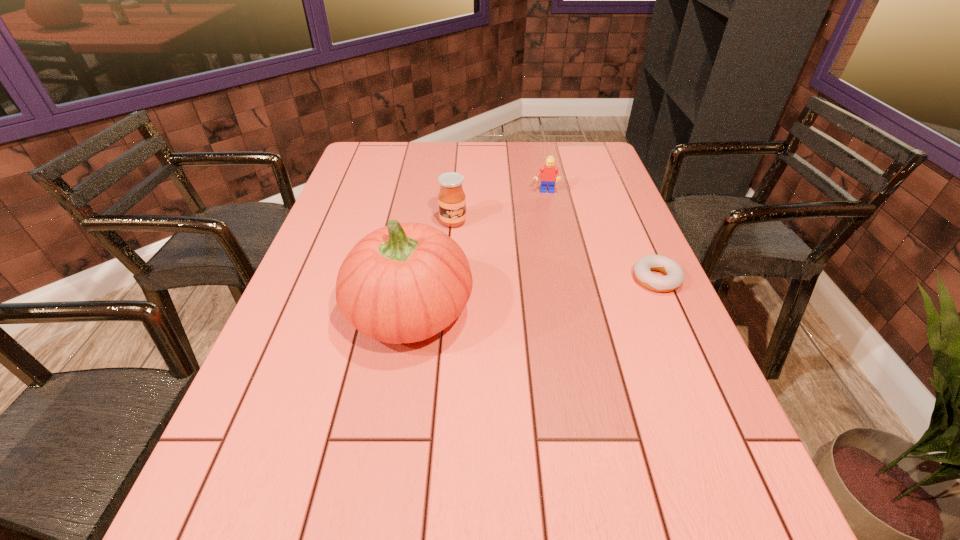
This screenshot has width=960, height=540. In order to click on free spot located 0.300m on the front-facing side of the farthest object in this screenshot , I will do `click(546, 255)`.

I want to click on vacant space positioned on the front-facing side of the farthest object, so click(x=546, y=235).

Identify the location of vacant area located on the front-facing side of the second farthest object. (496, 285).

Where is `blank area located 0.360m on the front-facing side of the second farthest object`? blank area located 0.360m on the front-facing side of the second farthest object is located at coordinates (516, 311).

Find the location of a particular element. This screenshot has height=540, width=960. free space located on the front-facing side of the second farthest object is located at coordinates (489, 273).

Identify the location of object that is at the left edge. (403, 283).

Image resolution: width=960 pixels, height=540 pixels. Identify the location of object at the right edge. (674, 273).

This screenshot has height=540, width=960. Identify the location of free spot at the far edge of the desktop. (477, 153).

Image resolution: width=960 pixels, height=540 pixels. I want to click on vacant space at the left edge of the desktop, so click(x=346, y=190).

I want to click on vacant area at the right edge of the desktop, so click(611, 220).